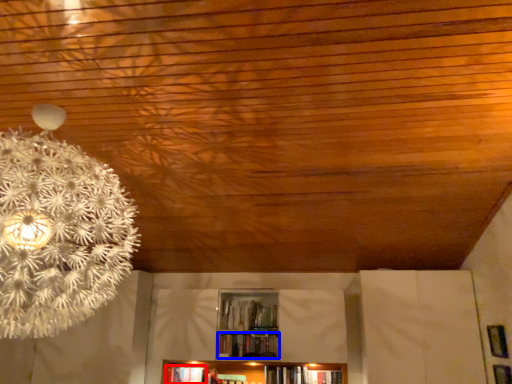
Question: Which point is further to the camera, book (highlighted by a red box) or book (highlighted by a blue box)?

Choices:
 (A) book
 (B) book

Answer: (A)